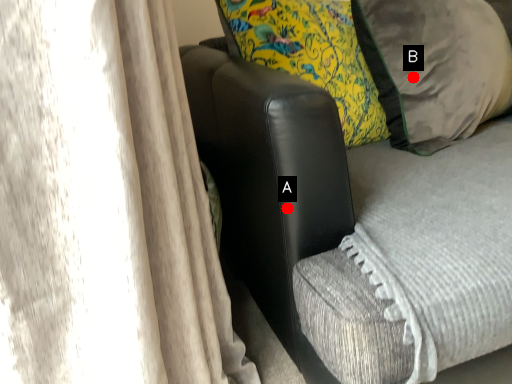
Question: Two points are circled on the image, labeled by A and B beside each circle. Which point appears closest to the camera in this image?

Choices:
 (A) A is closer
 (B) B is closer

Answer: (A)